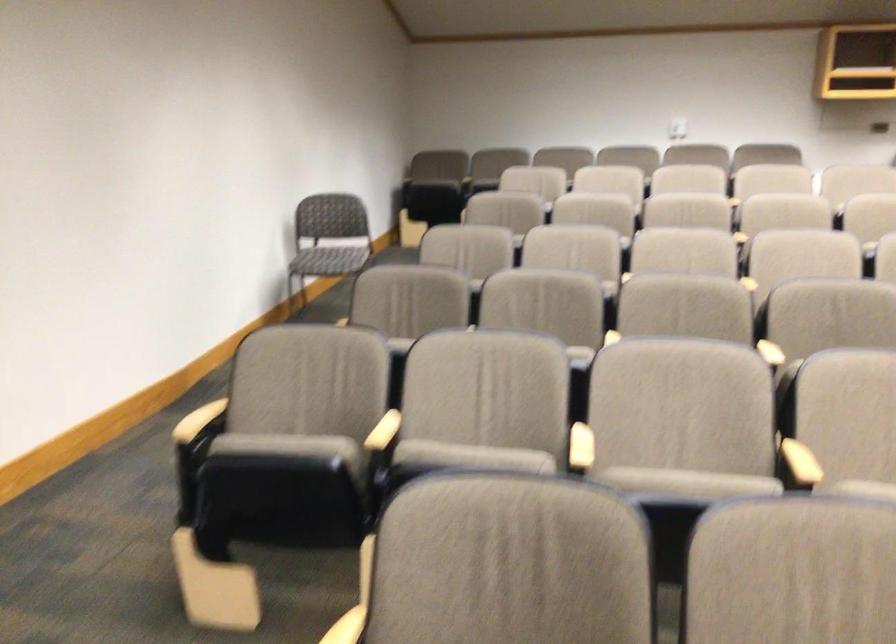
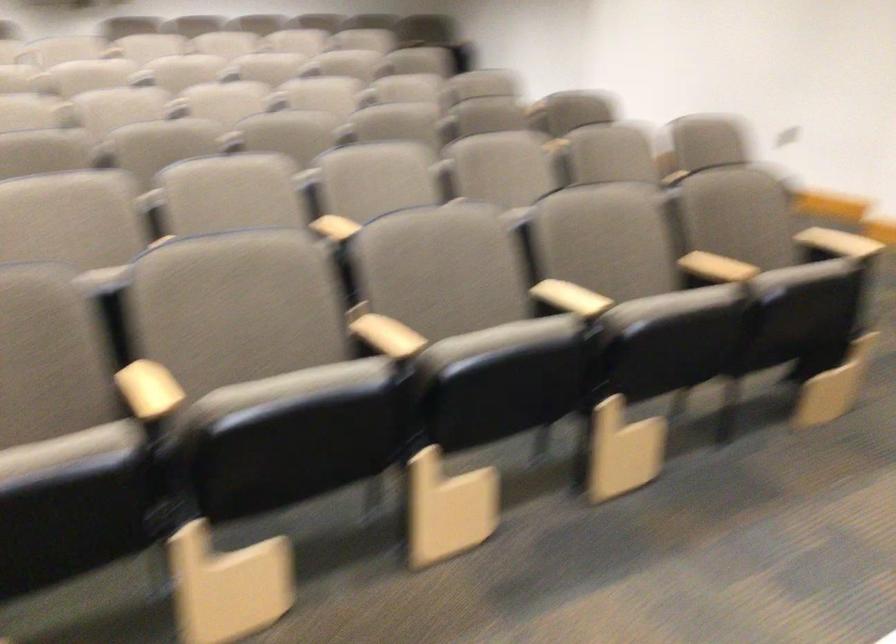
Question: The first image is from the beginning of the video and the second image is from the end. How did the camera likely rotate when shooting the video?

Choices:
 (A) Left
 (B) Right
 (C) Up
 (D) Down

Answer: (B)